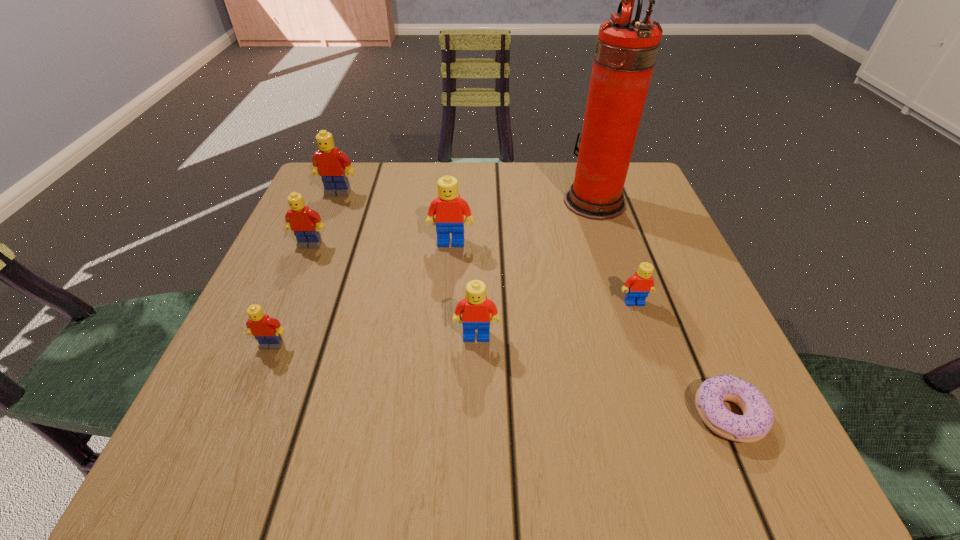
Where is `doughnut`? The width and height of the screenshot is (960, 540). doughnut is located at coordinates 757,419.

At what (x,y) coordinates should I click in order to perform the action: click on vacant point located at the discharge end of the fire extinguisher. Please return your answer as a coordinate pair (x, y). This screenshot has width=960, height=540. Looking at the image, I should click on (492, 201).

Find the location of a particular element. This screenshot has width=960, height=540. vacant space situated 0.310m at the discharge end of the fire extinguisher is located at coordinates (425, 201).

The width and height of the screenshot is (960, 540). Identify the location of free space located at the discharge end of the fire extinguisher. [x=537, y=201].

Where is `free space located 0.310m on the front-facing side of the farthest yellow Lego`? The height and width of the screenshot is (540, 960). free space located 0.310m on the front-facing side of the farthest yellow Lego is located at coordinates (296, 295).

I want to click on free space located on the face of the farthest red Lego, so click(x=446, y=304).

Locate an element on the screen. This screenshot has width=960, height=540. vacant space located on the front-facing side of the second nearest yellow Lego is located at coordinates (295, 281).

Identify the location of vacant space situated 0.100m on the face of the second biggest red Lego. The image size is (960, 540). (476, 399).

At what (x,y) coordinates should I click in order to perform the action: click on free space located on the face of the rightmost red Lego. Please return your answer as a coordinate pair (x, y). This screenshot has height=540, width=960. Looking at the image, I should click on (663, 388).

At what (x,y) coordinates should I click in order to perform the action: click on free space located on the front-facing side of the smallest yellow Lego. Please return your answer as a coordinate pair (x, y). Looking at the image, I should click on (240, 421).